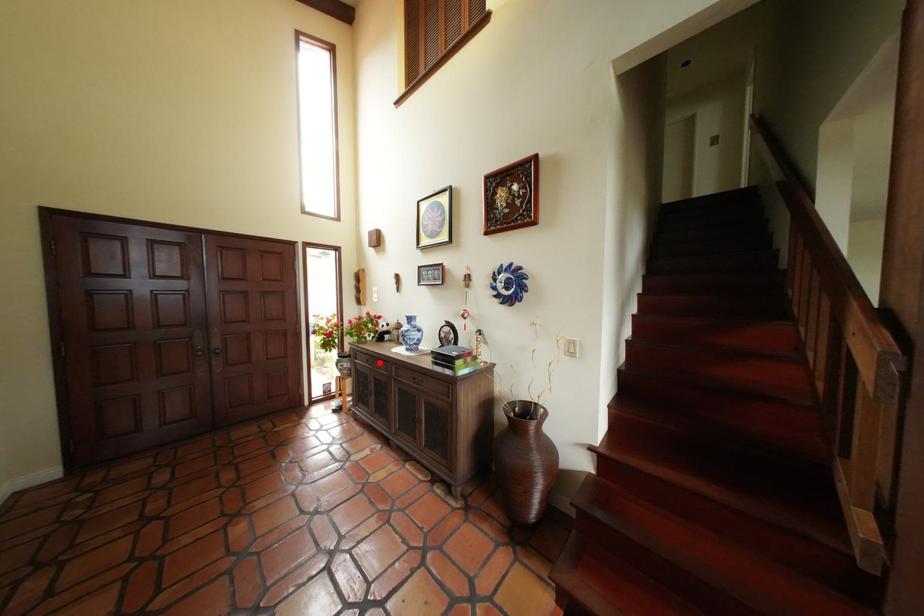
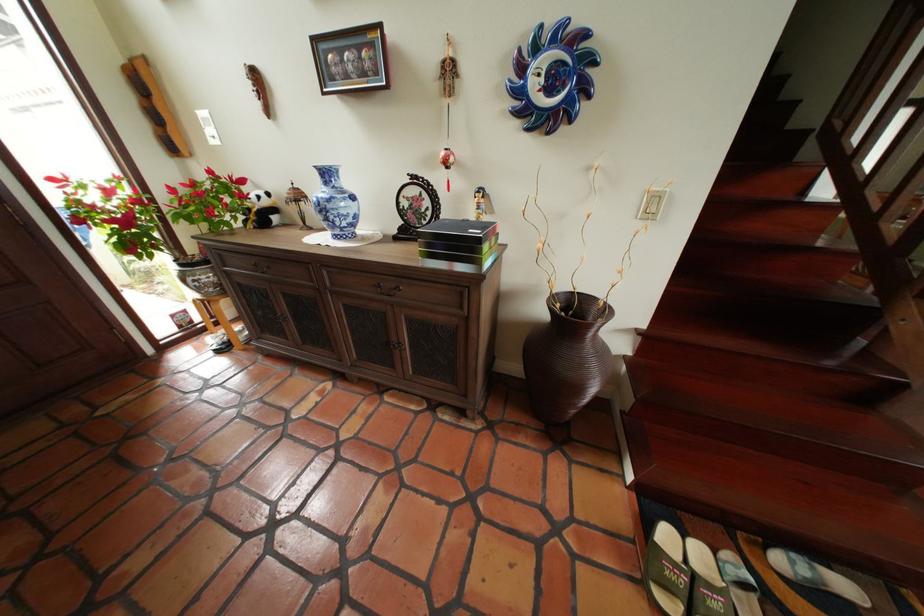
In the second image, find the point that corresponds to the highlighted location in the first image.

(266, 269)